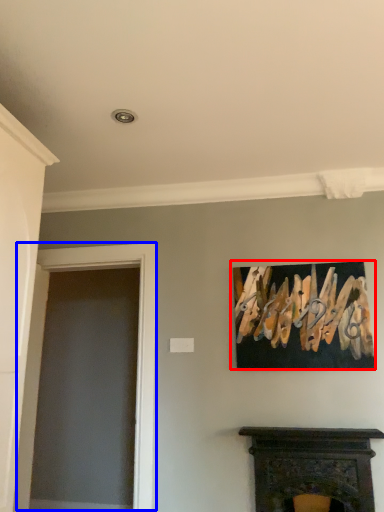
Question: Among these objects, which one is farthest to the camera, picture frame (highlighted by a red box) or glass door (highlighted by a blue box)?

Choices:
 (A) picture frame
 (B) glass door

Answer: (B)